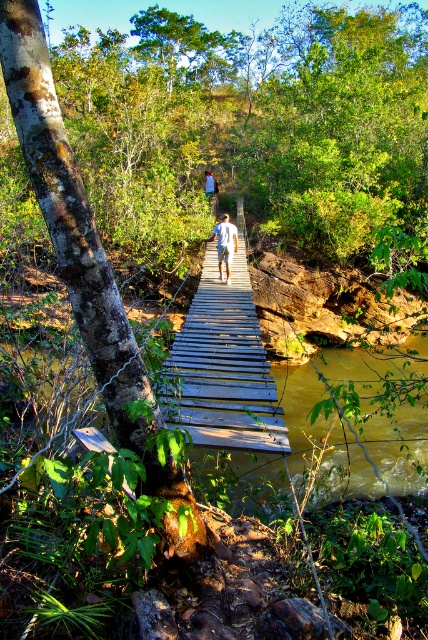
Question: Does wooden bridge at center have a greater width compared to brown muddy water at center?

Choices:
 (A) yes
 (B) no

Answer: (B)

Question: Which of the following is the farthest from the observer?

Choices:
 (A) brown muddy water at center
 (B) white cotton shirt at center
 (C) wooden bridge at center

Answer: (B)

Question: Estimate the real-world distances between objects in this image. Which object is farther from the white cotton shirt at center?

Choices:
 (A) wooden bridge at center
 (B) brown muddy water at center

Answer: (B)

Question: Which object appears farthest from the camera in this image?

Choices:
 (A) white cotton shirt at center
 (B) wooden bridge at center

Answer: (A)

Question: Where is brown muddy water at center located in relation to white cotton shirt at center in the image?

Choices:
 (A) above
 (B) below

Answer: (B)

Question: Can you confirm if wooden bridge at center is smaller than brown muddy water at center?

Choices:
 (A) no
 (B) yes

Answer: (B)